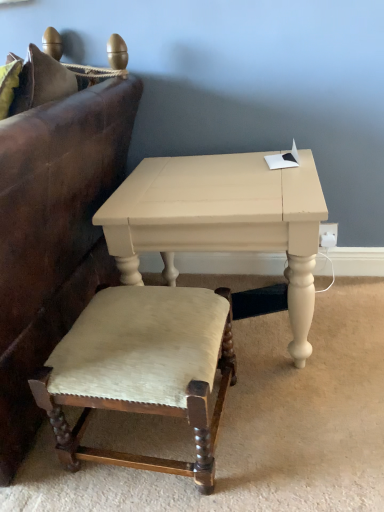
Locate an element on the screen. The height and width of the screenshot is (512, 384). free space on the front side of matte white table at center is located at coordinates (277, 435).